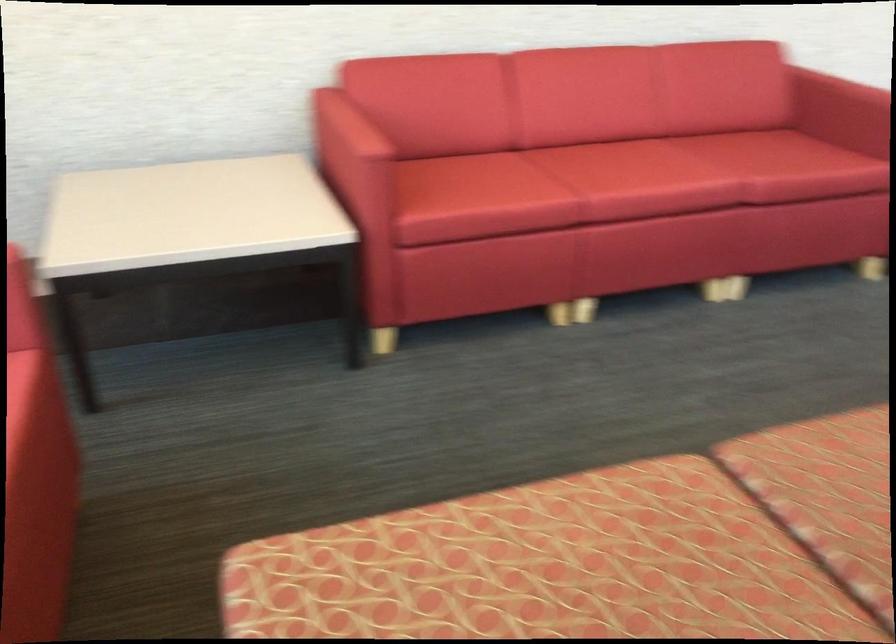
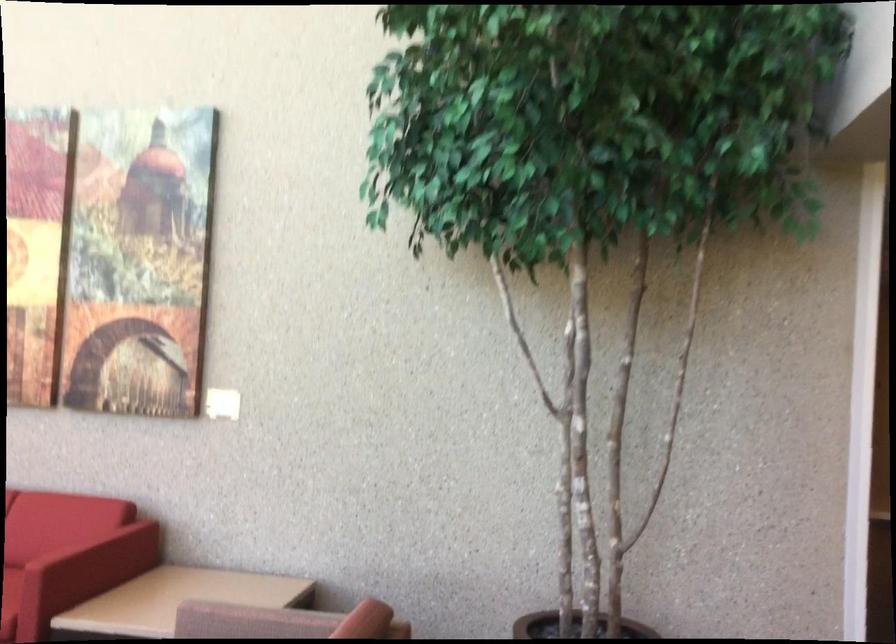
Where in the second image is the point corresponding to point 787,95 from the first image?

(80, 540)